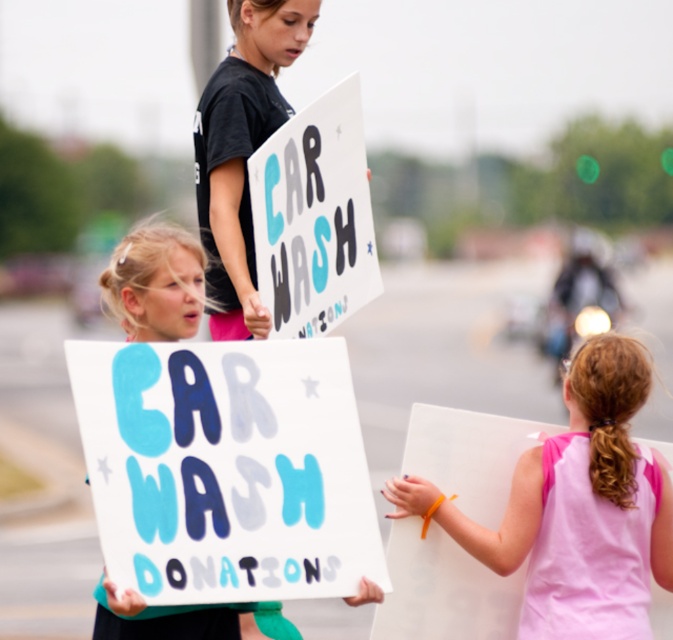
Which is more to the left, hand-painted cardboard sign at center or pink fabric sign at right?

From the viewer's perspective, hand-painted cardboard sign at center appears more on the left side.

Can you confirm if hand-painted cardboard sign at center is positioned to the right of pink fabric sign at right?

Incorrect, hand-painted cardboard sign at center is not on the right side of pink fabric sign at right.

The image size is (673, 640). Identify the location of hand-painted cardboard sign at center. (225, 468).

Who is taller, pink fabric sign at right or hand-painted cardboard sign at upper center?

hand-painted cardboard sign at upper center is taller.

Who is lower down, pink fabric sign at right or hand-painted cardboard sign at upper center?

pink fabric sign at right is below.

Is point (540, 625) positioned after point (363, 168)?

No.

Locate an element on the screen. This screenshot has height=640, width=673. pink fabric sign at right is located at coordinates (575, 506).

Could you measure the distance between hand-painted cardboard sign at center and hand-painted cardboard sign at upper center?

1.88 meters

Who is shorter, hand-painted cardboard sign at center or hand-painted cardboard sign at upper center?

Standing shorter between the two is hand-painted cardboard sign at center.

This screenshot has width=673, height=640. Describe the element at coordinates (225, 468) in the screenshot. I see `hand-painted cardboard sign at center` at that location.

Where is `hand-painted cardboard sign at center`? hand-painted cardboard sign at center is located at coordinates (225, 468).